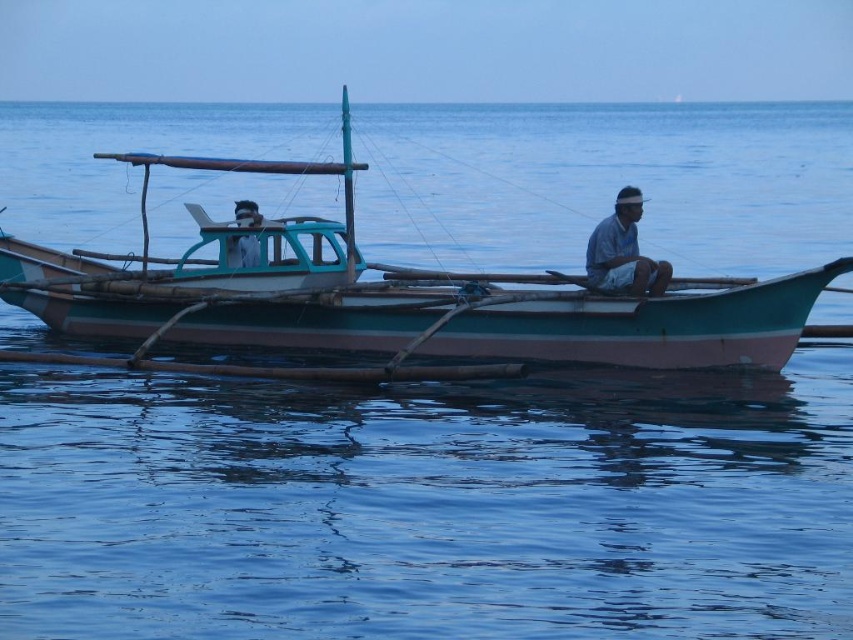
Question: Which object is farther from the camera taking this photo?

Choices:
 (A) white woven hat at center
 (B) matte blue shirt at center

Answer: (B)

Question: Among these points, which one is nearest to the camera?

Choices:
 (A) (258, 282)
 (B) (618, 230)
 (C) (239, 241)

Answer: (B)

Question: Can you confirm if teal wooden boat at center is positioned to the left of white woven hat at center?

Choices:
 (A) yes
 (B) no

Answer: (A)

Question: Is teal wooden boat at center bigger than white woven hat at center?

Choices:
 (A) no
 (B) yes

Answer: (B)

Question: Which point is farther from the camera taking this photo?

Choices:
 (A) (614, 288)
 (B) (248, 208)
 (C) (735, 356)

Answer: (B)

Question: From the image, what is the correct spatial relationship of white woven hat at center in relation to matte blue shirt at center?

Choices:
 (A) left
 (B) right

Answer: (B)